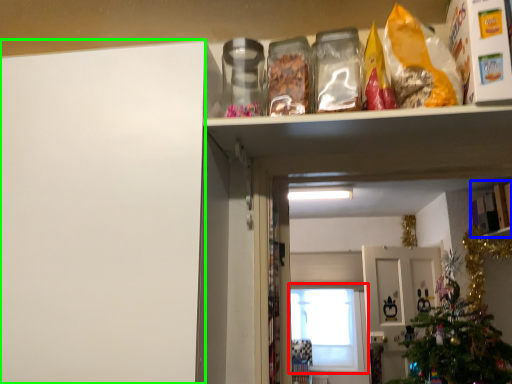
Question: Estimate the real-world distances between objects in this image. Which object is closer to window (highlighted by a red box), cabinet (highlighted by a blue box) or leftover (highlighted by a green box)?

Choices:
 (A) cabinet
 (B) leftover

Answer: (A)